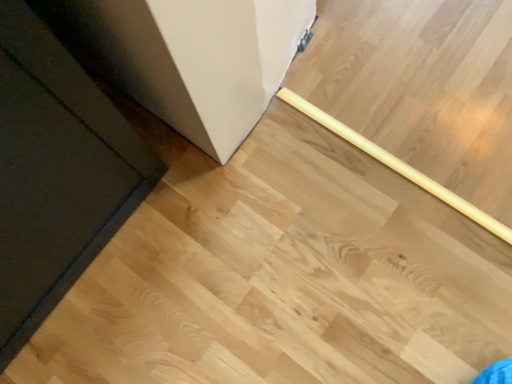
Find the location of a particular element. The height and width of the screenshot is (384, 512). matte black mat at lower left is located at coordinates (56, 174).

What do you see at coordinates (56, 174) in the screenshot?
I see `matte black mat at lower left` at bounding box center [56, 174].

At what (x,y) coordinates should I click in order to perform the action: click on matte black mat at lower left. Please return your answer as a coordinate pair (x, y). Looking at the image, I should click on (56, 174).